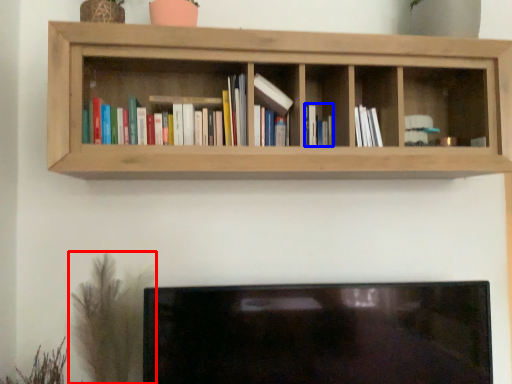
Question: Which object is closer to the camera taking this photo, plant (highlighted by a red box) or book (highlighted by a blue box)?

Choices:
 (A) plant
 (B) book

Answer: (A)